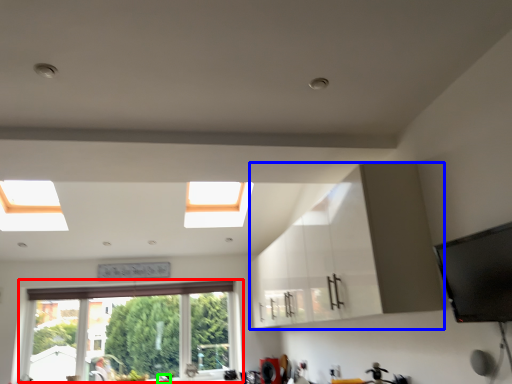
Question: Based on their relative distances, which object is farther from window (highlighted by a red box)? Choose from cabinetry (highlighted by a blue box) and faucet (highlighted by a green box).

Choices:
 (A) cabinetry
 (B) faucet

Answer: (A)